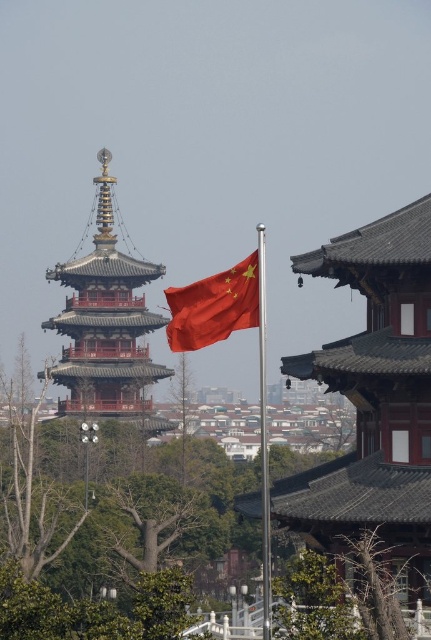
Does green leafy tree at center have a greater height compared to red lacquered pagoda at center?

Incorrect, green leafy tree at center's height is not larger of red lacquered pagoda at center's.

Who is more forward, (233, 486) or (152, 365)?

Point (233, 486)

Between point (162, 547) and point (99, 339), which one is positioned behind?

The point (99, 339) is behind.

I want to click on green leafy tree at center, so click(x=108, y=528).

Who is positioned more to the left, red lacquered pagoda at center or red fabric flag at center?

red lacquered pagoda at center

Based on the photo, can you confirm if red lacquered pagoda at center is bigger than red fabric flag at center?

Correct, red lacquered pagoda at center is larger in size than red fabric flag at center.

Between point (109, 333) and point (241, 328), which one is positioned in front?

Point (241, 328) is more forward.

I want to click on red lacquered pagoda at center, so click(x=106, y=326).

Is green leafy tree at center behind red fabric flag at center?

Yes, it is behind red fabric flag at center.

Which is below, green leafy tree at center or red fabric flag at center?

green leafy tree at center is lower down.

Who is more forward, [125,561] or [211,330]?

Point [211,330] is in front.

Find the location of a particular element. green leafy tree at center is located at coordinates (108, 528).